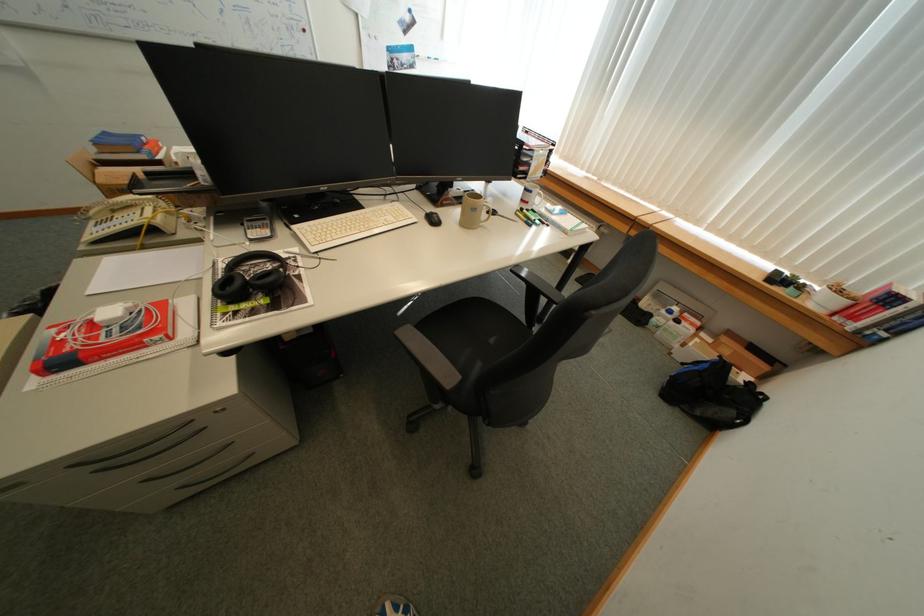
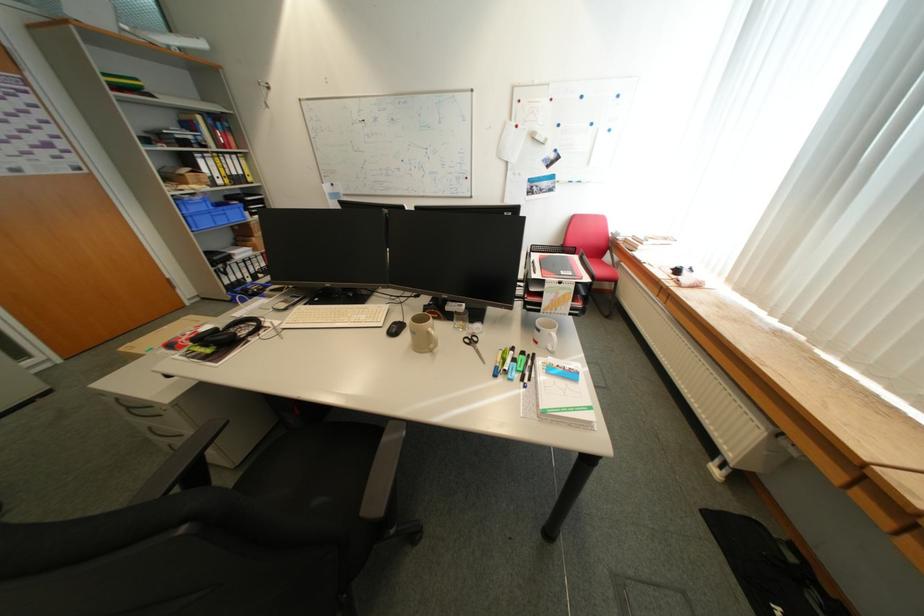
The point at (x=541, y=193) is marked in the first image. Where is the corresponding point in the second image?

(548, 331)